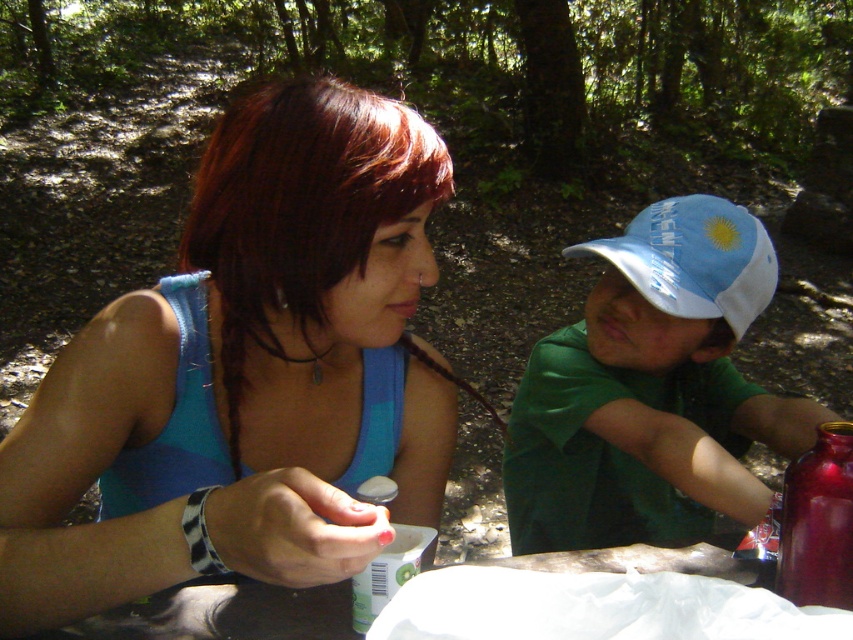
You are planning to take a photo of the matte blue tank top at center and the blue fabric baseball cap at upper right. To ensure both items are in focus, you need to know their vertical positions. Which item is located higher in the image?

The blue fabric baseball cap at upper right is higher because the matte blue tank top at center is positioned under it.

You are planning to place a small decorative item between the matte blue tank top at center and the shiny metallic bottle at right. Based on their positions, which object should the item be closer to?

The matte blue tank top at center is positioned on the left side of the shiny metallic bottle at right, so the small decorative item should be placed closer to the shiny metallic bottle at right to maintain symmetry between the two objects.

You are a photographer taking a picture of the matte blue tank top at center and the shiny metallic bottle at right. Which object should you focus on first if you want to capture both clearly in your photo?

The matte blue tank top at center should be focused on first because it is located above the shiny metallic bottle at right, so adjusting focus starting from the higher object ensures both are in frame and sharp.